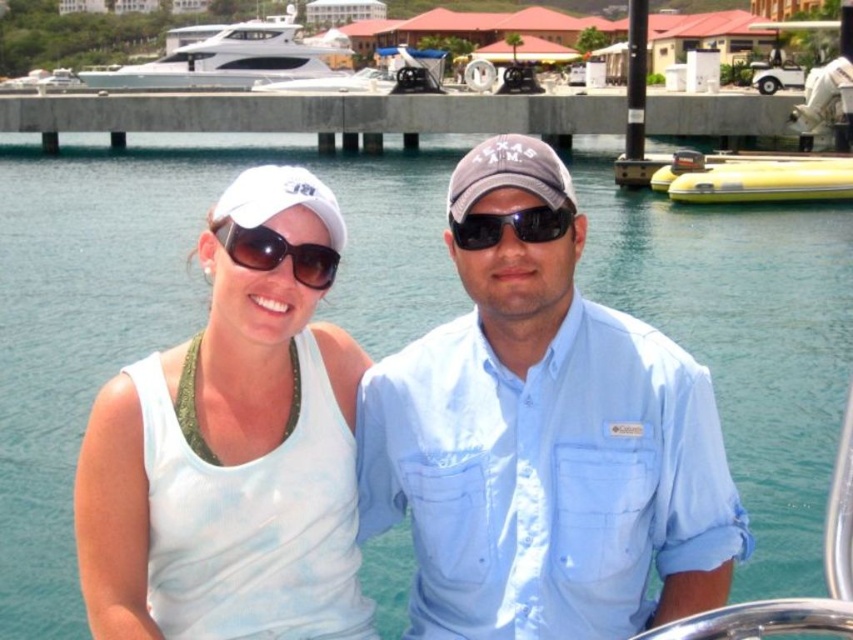
You are a photographer trying to capture a clear shot of the white matte tank top at center and the white fabric baseball cap at upper left. Which object should you focus on first if you want to ensure both are in focus without adjusting your camera settings?

The white matte tank top at center is not as tall as the white fabric baseball cap at upper left, so focusing on the taller object first would help ensure both are in focus.

You are a photographer positioned at the camera location. You want to take a photo of the concrete at center. Since the concrete is 65.71 meters away, will you need a telephoto lens to capture it clearly?

Yes, because the concrete at center is 65.71 meters away from the camera, a telephoto lens would be necessary to capture it clearly from that distance.

You are a photographer trying to take a photo of the yellow rubber boat at right without the sunglasses at center appearing in the frame. Is this possible given their current positions?

The yellow rubber boat at right is positioned over the sunglasses at center, so if you aim your camera to capture the yellow rubber boat at right, the sunglasses at center will be obscured by it and won